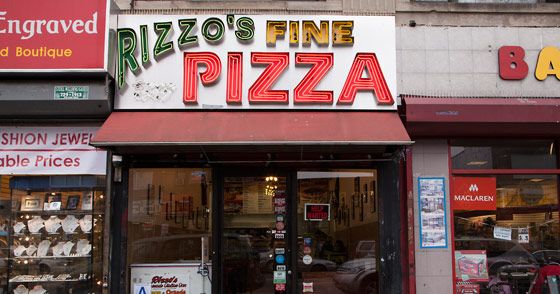
Locate an element on the screen. door is located at coordinates (309, 216).